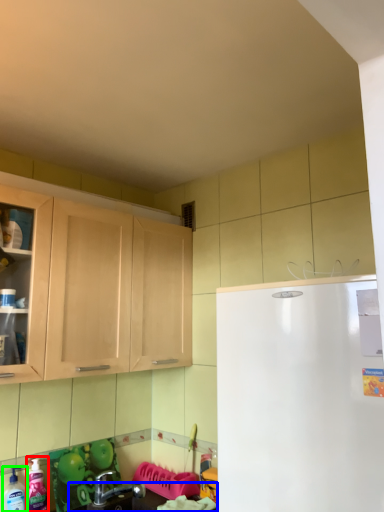
Question: Considering the real-world distances, which object is farthest from cleaning product (highlighted by a red box)? counter top (highlighted by a blue box) or cleaning product (highlighted by a green box)?

Choices:
 (A) counter top
 (B) cleaning product

Answer: (A)